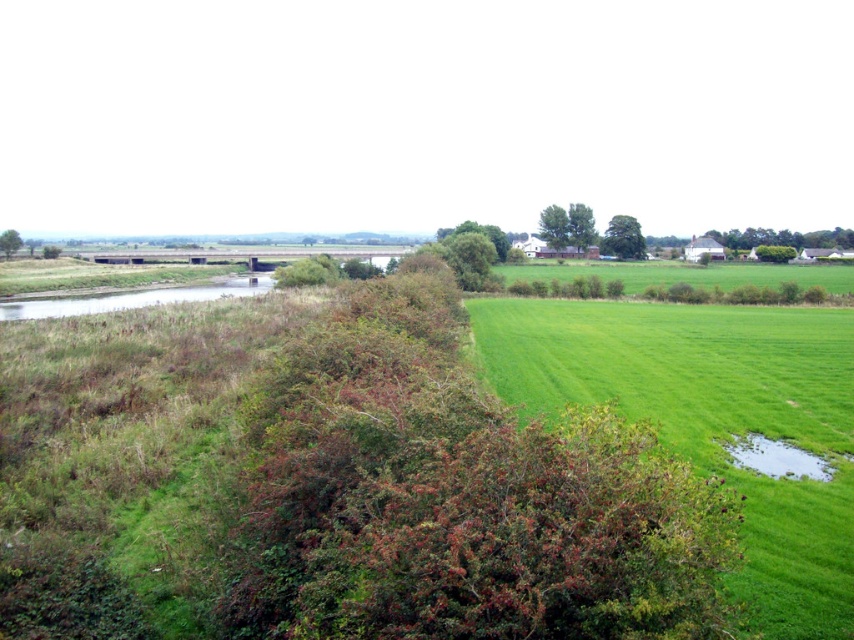
Question: Is green grass at center positioned at the back of green grassy waterway at lower left?

Choices:
 (A) yes
 (B) no

Answer: (B)

Question: In this image, where is green grass at center located relative to green grassy waterway at lower left?

Choices:
 (A) below
 (B) above

Answer: (A)

Question: Which point is closer to the camera?

Choices:
 (A) green grass at center
 (B) green grassy waterway at lower left

Answer: (A)

Question: Does green grass at center appear over green grassy waterway at lower left?

Choices:
 (A) yes
 (B) no

Answer: (B)